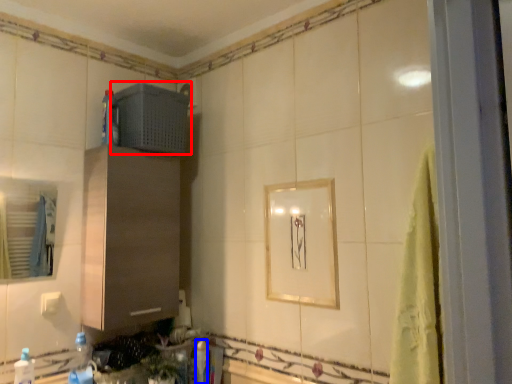
Question: Which of the following is the farthest to the observer, appliance (highlighted by a red box) or bottle (highlighted by a blue box)?

Choices:
 (A) appliance
 (B) bottle

Answer: (B)